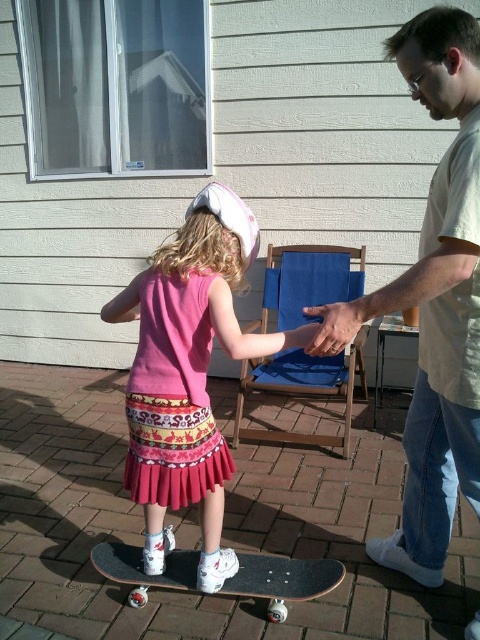
Who is positioned more to the right, light beige shirt at right or pink fabric skirt at center?

Positioned to the right is light beige shirt at right.

Is light beige shirt at right below pink fabric skirt at center?

Actually, light beige shirt at right is above pink fabric skirt at center.

Who is more forward, (x=410, y=74) or (x=168, y=433)?

Positioned in front is point (x=410, y=74).

Locate an element on the screen. This screenshot has width=480, height=640. light beige shirt at right is located at coordinates (440, 300).

Between wooden skateboard at center and smooth skin hand at center, which one appears on the right side from the viewer's perspective?

Positioned to the right is smooth skin hand at center.

Who is more distant from viewer, (141, 577) or (364, 314)?

The point (141, 577) is behind.

This screenshot has width=480, height=640. What do you see at coordinates (283, 579) in the screenshot? I see `wooden skateboard at center` at bounding box center [283, 579].

This screenshot has width=480, height=640. Find the location of `wooden skateboard at center`. wooden skateboard at center is located at coordinates (283, 579).

Can you confirm if light beige shirt at right is taller than wooden skateboard at center?

Correct, light beige shirt at right is much taller as wooden skateboard at center.

Does light beige shirt at right lie in front of wooden skateboard at center?

Yes.

Is point (446, 268) farther from viewer compared to point (312, 592)?

No, it is in front of (312, 592).

The image size is (480, 640). I want to click on light beige shirt at right, so 440,300.